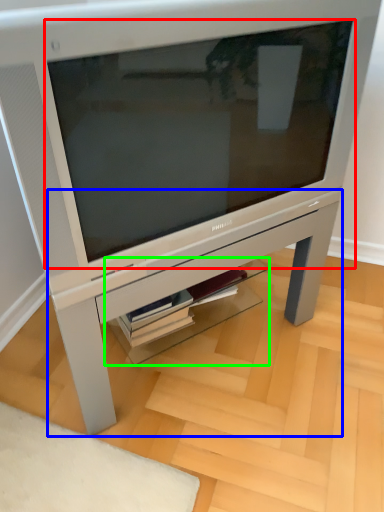
Question: Which is farther away from computer monitor (highlighted by a red box)? table (highlighted by a blue box) or shelf (highlighted by a green box)?

Choices:
 (A) table
 (B) shelf

Answer: (B)